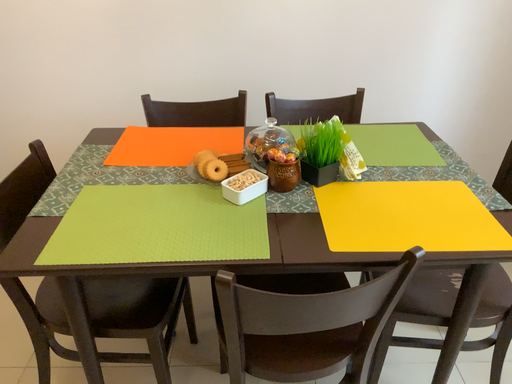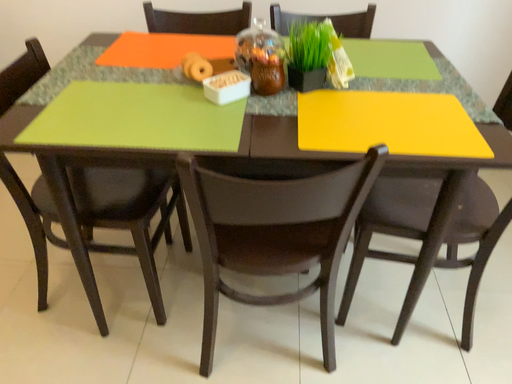
Question: How did the camera likely rotate when shooting the video?

Choices:
 (A) rotated upward
 (B) rotated downward

Answer: (B)